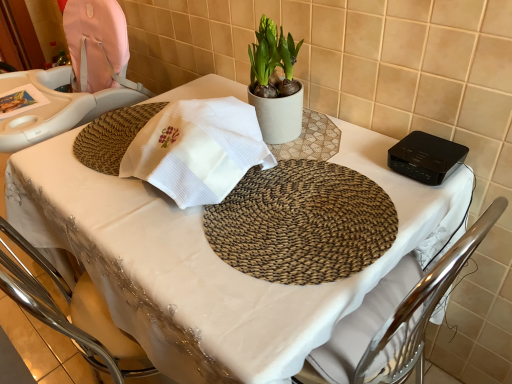
What is the approximate height of black plastic device at upper right?

black plastic device at upper right is 1.65 inches tall.

Describe the element at coordinates (426, 157) in the screenshot. I see `black plastic device at upper right` at that location.

The image size is (512, 384). Find the location of `black plastic device at upper right`. black plastic device at upper right is located at coordinates (426, 157).

In order to face matte beige pot at center, should I rotate leftwards or rightwards?

To face it directly, rotate right by 2.377 degrees.

Where is `matte beige pot at center`? matte beige pot at center is located at coordinates (275, 84).

This screenshot has height=384, width=512. What do you see at coordinates (275, 84) in the screenshot?
I see `matte beige pot at center` at bounding box center [275, 84].

Where is `black plastic device at upper right`? The image size is (512, 384). black plastic device at upper right is located at coordinates click(x=426, y=157).

Can you confirm if matte beige pot at center is positioned to the right of black plastic device at upper right?

No.

Between matte beige pot at center and black plastic device at upper right, which one is positioned in front?

Positioned in front is black plastic device at upper right.

Is point (275, 122) positioned after point (464, 159)?

Yes.

From the image's perspective, which is above, matte beige pot at center or black plastic device at upper right?

matte beige pot at center.

From a real-world perspective, between matte beige pot at center and black plastic device at upper right, who is vertically lower?

In real-world perspective, black plastic device at upper right is lower.

Which object is thinner, matte beige pot at center or black plastic device at upper right?

matte beige pot at center.

Between matte beige pot at center and black plastic device at upper right, which one has more height?

matte beige pot at center.

Consider the image. Who is smaller, matte beige pot at center or black plastic device at upper right?

black plastic device at upper right.

Choose the correct answer: Is matte beige pot at center inside black plastic device at upper right or outside it?

matte beige pot at center is located beyond the bounds of black plastic device at upper right.

Is the surface of matte beige pot at center in direct contact with black plastic device at upper right?

matte beige pot at center and black plastic device at upper right are not in contact.

Could you tell me if matte beige pot at center is turned towards black plastic device at upper right?

No, matte beige pot at center is not facing towards black plastic device at upper right.

What's the angular difference between matte beige pot at center and black plastic device at upper right's facing directions?

matte beige pot at center and black plastic device at upper right are facing 0.00276 degrees away from each other.

Where is `houseplant positioned vertically above the black plastic device at upper right (from a real-world perspective)`? houseplant positioned vertically above the black plastic device at upper right (from a real-world perspective) is located at coordinates (275, 84).

Consider the image. Can you confirm if black plastic device at upper right is positioned to the left of matte beige pot at center?

No.

Is black plastic device at upper right further to camera compared to matte beige pot at center?

No.

Is point (441, 178) positioned behind point (301, 41)?

No.

From the image's perspective, between black plastic device at upper right and matte beige pot at center, which one is located above?

matte beige pot at center is shown above in the image.

Based on the photo, from a real-world perspective, which object rests below the other?

black plastic device at upper right is physically lower.

Does black plastic device at upper right have a greater width compared to matte beige pot at center?

Indeed, black plastic device at upper right has a greater width compared to matte beige pot at center.

Considering the sizes of objects black plastic device at upper right and matte beige pot at center in the image provided, who is shorter, black plastic device at upper right or matte beige pot at center?

black plastic device at upper right is shorter.

Based on the photo, between black plastic device at upper right and matte beige pot at center, which one has smaller size?

Answer: black plastic device at upper right is smaller.

Is black plastic device at upper right located outside matte beige pot at center?

Yes, black plastic device at upper right is outside of matte beige pot at center.

Is black plastic device at upper right positioned far away from matte beige pot at center?

That's not correct — black plastic device at upper right is a little close to matte beige pot at center.

Is matte beige pot at center at the back of black plastic device at upper right?

No, matte beige pot at center is not at the back of black plastic device at upper right.

How different are the orientations of black plastic device at upper right and matte beige pot at center in degrees?

The angular difference between black plastic device at upper right and matte beige pot at center is 0.00276 degrees.

At what (x,y) coordinates should I click in order to perform the action: click on houseplant that appears on the left of black plastic device at upper right. Please return your answer as a coordinate pair (x, y). Looking at the image, I should click on (275, 84).

The image size is (512, 384). What are the coordinates of `gadget on the right of matte beige pot at center` in the screenshot? It's located at (426, 157).

This screenshot has height=384, width=512. In order to click on gadget that appears below the matte beige pot at center (from a real-world perspective) in this screenshot , I will do `click(426, 157)`.